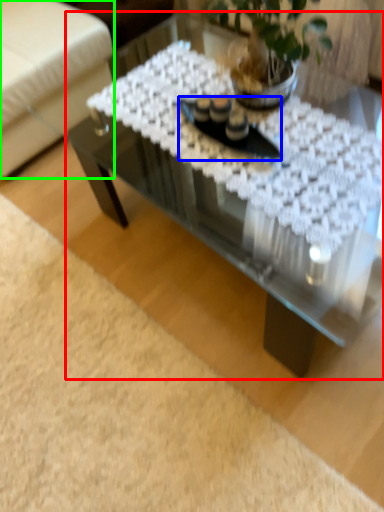
Question: Which object is the farthest from coffee table (highlighted by a red box)? Choose among these: glass plate (highlighted by a blue box) or armchair (highlighted by a green box).

Choices:
 (A) glass plate
 (B) armchair

Answer: (B)